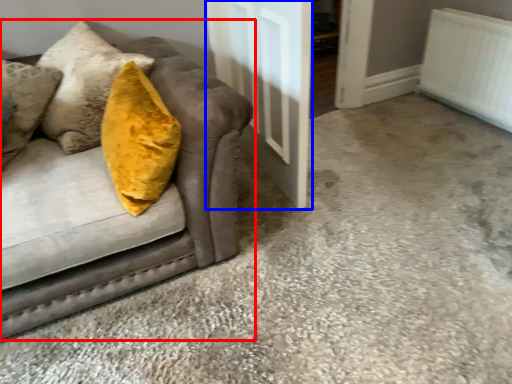
Question: Which point is closer to the camera, studio couch (highlighted by a red box) or door (highlighted by a blue box)?

Choices:
 (A) studio couch
 (B) door

Answer: (A)